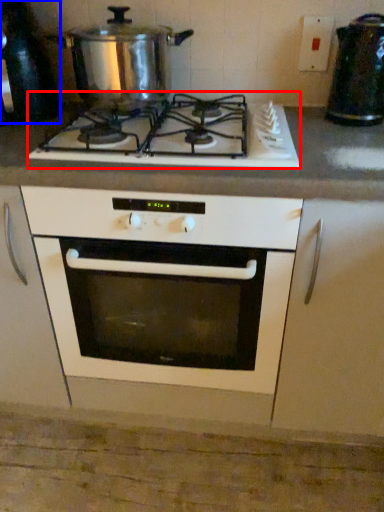
Question: Among these objects, which one is farthest to the camera, gas stove (highlighted by a red box) or appliance (highlighted by a blue box)?

Choices:
 (A) gas stove
 (B) appliance

Answer: (B)